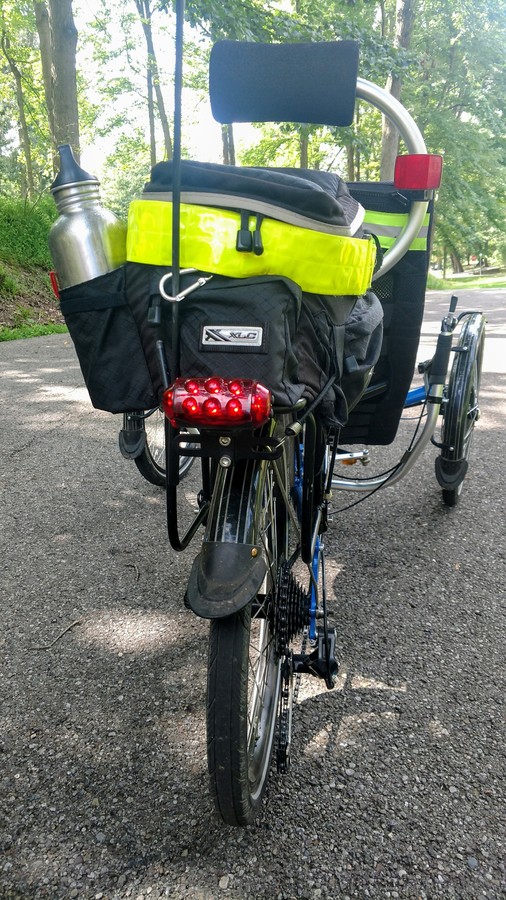
The width and height of the screenshot is (506, 900). I want to click on hook, so click(168, 297).